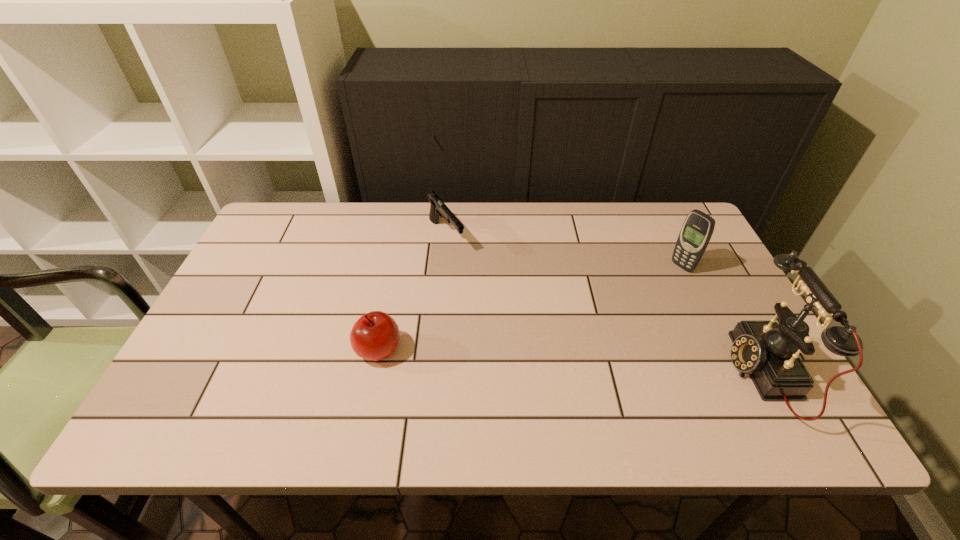
The width and height of the screenshot is (960, 540). In order to click on free spot between the telephone and the apple in this screenshot , I will do `click(571, 361)`.

This screenshot has height=540, width=960. I want to click on free spot between the leftmost object and the second farthest object, so click(531, 308).

The image size is (960, 540). Identify the location of vacant area that lies between the second farthest object and the farthest object. (564, 251).

Where is `free spot between the tallest object and the second object from left to right`? This screenshot has height=540, width=960. free spot between the tallest object and the second object from left to right is located at coordinates (604, 304).

Where is `free space between the apple and the gun`? The height and width of the screenshot is (540, 960). free space between the apple and the gun is located at coordinates (413, 293).

This screenshot has height=540, width=960. What are the coordinates of `vacant region between the tallest object and the leftmost object` in the screenshot? It's located at (571, 361).

This screenshot has width=960, height=540. I want to click on vacant area between the gun and the second farthest object, so click(564, 251).

Image resolution: width=960 pixels, height=540 pixels. I want to click on free area in between the leftmost object and the tallest object, so click(x=571, y=361).

This screenshot has width=960, height=540. I want to click on object that can be found as the third closest to the farthest object, so click(768, 351).

Choose which object is the second nearest neighbor to the apple. Please provide its 2D coordinates. Your answer should be formatted as a tuple, i.e. [(x, y)], where the tuple contains the x and y coordinates of a point satisfying the conditions above.

[(697, 229)]